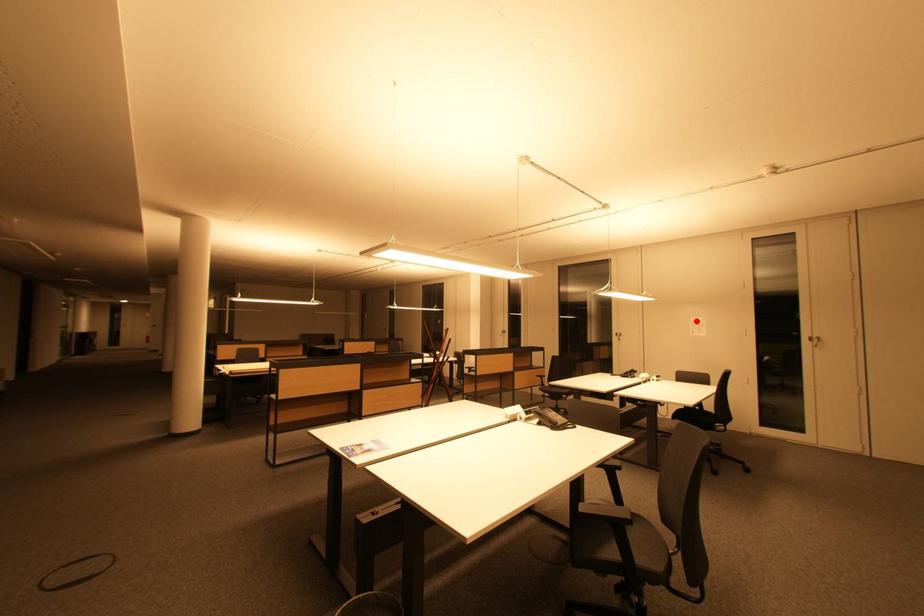
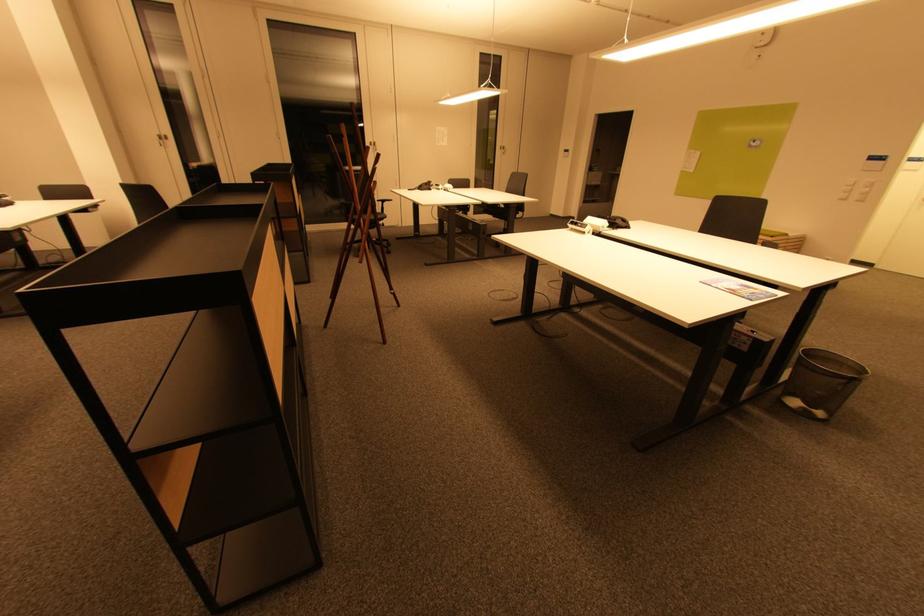
Question: I am providing you with two images of the same scene from different viewpoints. A red point is shown in image1. For the corresponding object point in image2, is it positioned nearer or farther from the camera?

Choices:
 (A) Nearer
 (B) Farther

Answer: (A)